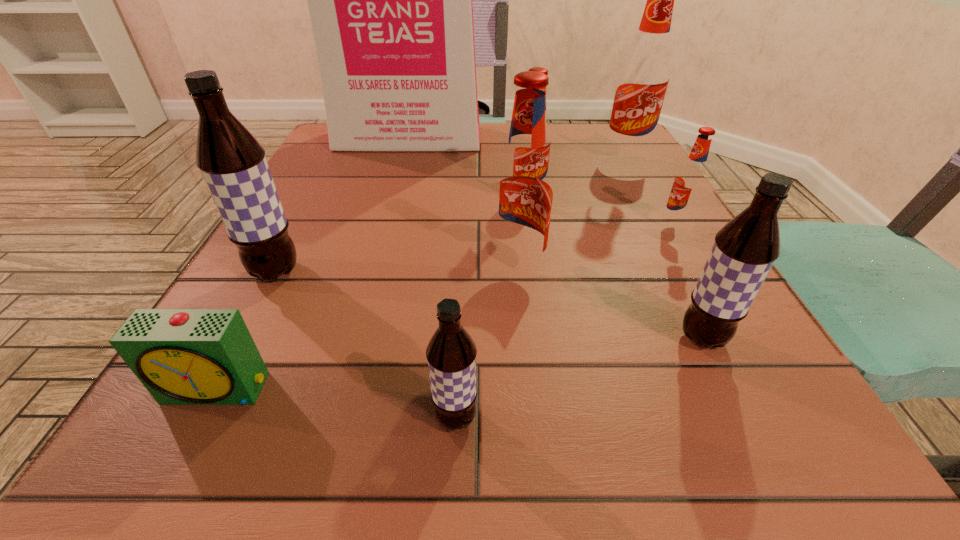
The image size is (960, 540). I want to click on vacant space located on the back of the leftmost root beer, so click(320, 188).

Where is `free spot located on the left of the second nearest root beer`? free spot located on the left of the second nearest root beer is located at coordinates (566, 338).

This screenshot has width=960, height=540. Find the location of `vacant space located on the left of the second smallest red root beer`. vacant space located on the left of the second smallest red root beer is located at coordinates (391, 197).

Locate an element on the screen. vacant space located on the back of the smallest red root beer is located at coordinates (625, 138).

Image resolution: width=960 pixels, height=540 pixels. In order to click on free space located on the back of the nearest brown root beer in this screenshot , I will do `click(462, 286)`.

The height and width of the screenshot is (540, 960). I want to click on vacant space located 0.080m on the front-facing side of the green alarm clock, so point(172,475).

Where is `shopping bag that is at the far edge`? The image size is (960, 540). shopping bag that is at the far edge is located at coordinates (390, 0).

Image resolution: width=960 pixels, height=540 pixels. Find the location of `root beer present at the far edge`. root beer present at the far edge is located at coordinates (644, 74).

Where is `root beer that is at the near edge`? The image size is (960, 540). root beer that is at the near edge is located at coordinates (451, 353).

The image size is (960, 540). Find the location of `alarm clock located in the near edge section of the desktop`. alarm clock located in the near edge section of the desktop is located at coordinates (182, 356).